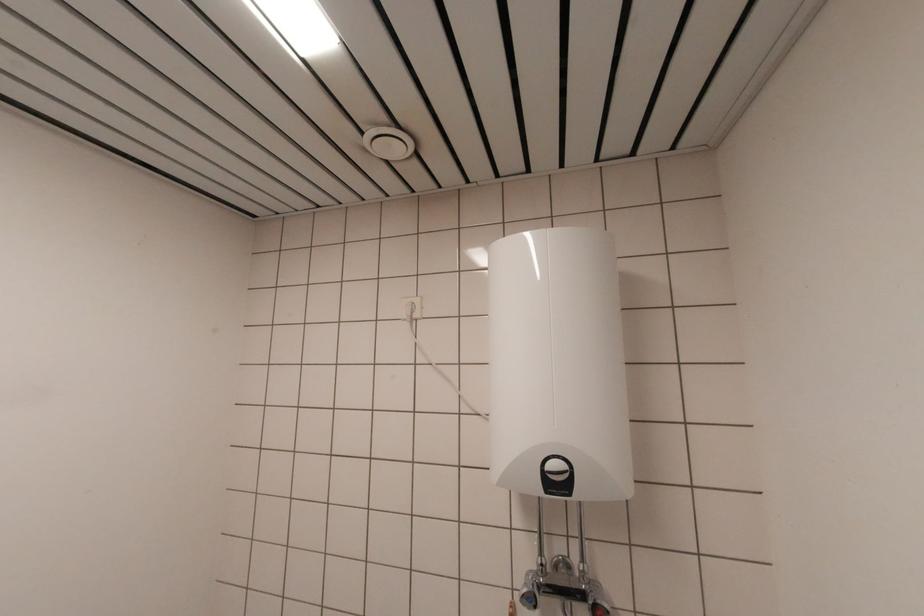
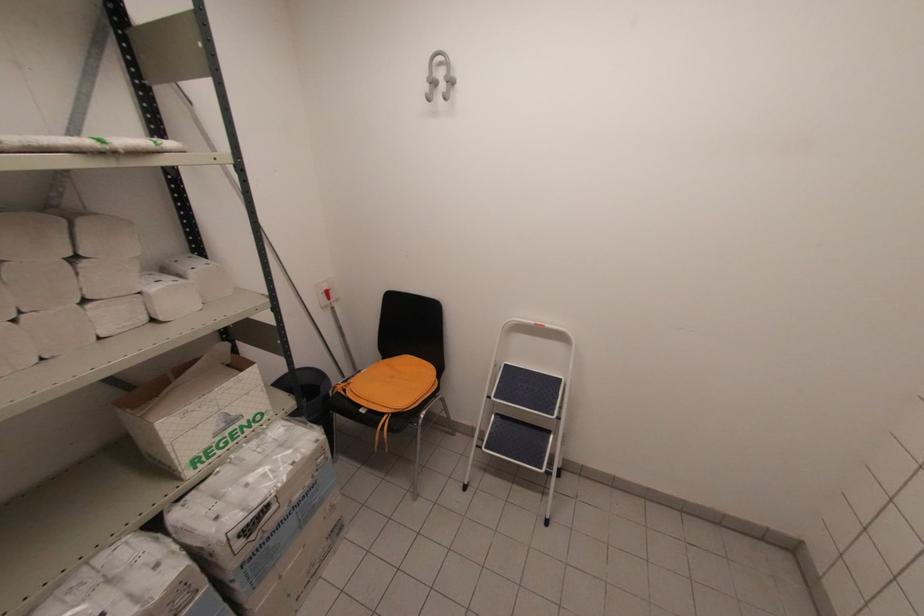
Based on the continuous images, in which direction is the camera rotating?

The rotation direction of the camera is left-down.